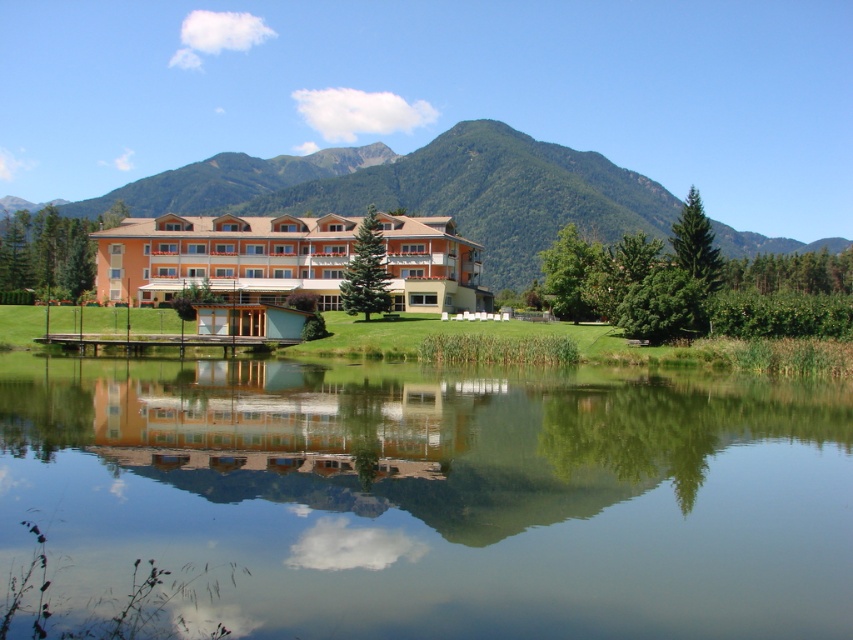
You are a tourist standing at the entrance of the building. You want to take a photo that includes both the transparent glass water at center and the green textured mountain at center. Which of the two objects should you focus on first to ensure both are in the frame?

You should focus on the green textured mountain at center first because it is taller than the transparent glass water at center, so you need to adjust your camera angle to include its full height while still capturing the water.

You are standing at the water edge in the image and want to walk towards the building. Which point, point (45,515) or point (310,196), is closer to you?

Point (45,515) is in front of point (310,196), so it is closer to you.

You are a landscape architect planning to install a new pathway between the transparent glass water at center and the orange matte building at center. Considering their widths, which object requires more space to accommodate the pathway?

The orange matte building at center has a greater width than the transparent glass water at center, so it requires more space to accommodate the pathway.